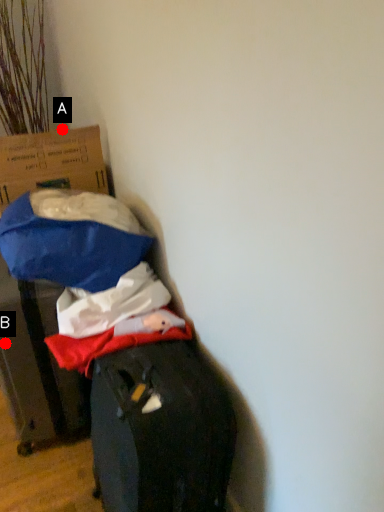
Question: Two points are circled on the image, labeled by A and B beside each circle. Which point is closer to the camera?

Choices:
 (A) A is closer
 (B) B is closer

Answer: (B)